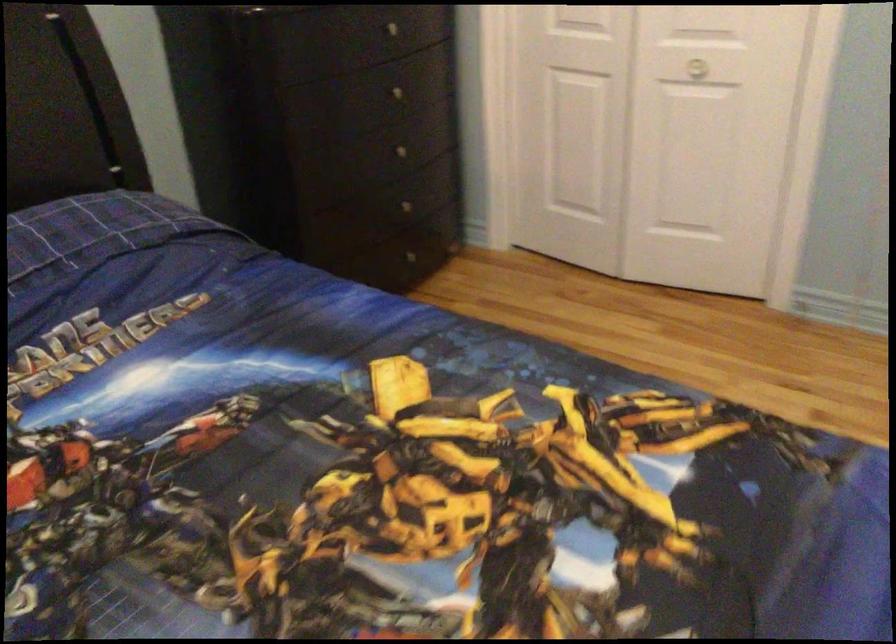
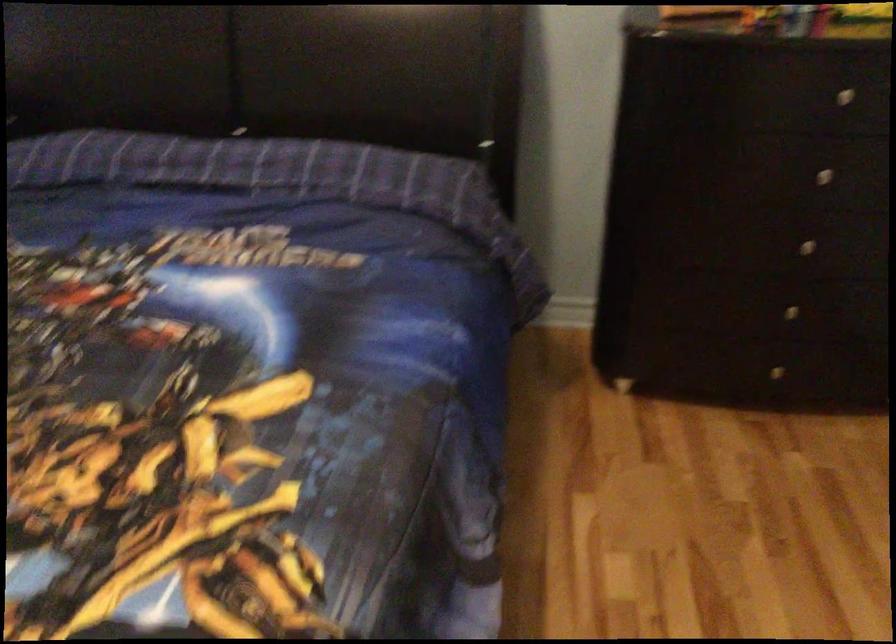
In the second image, find the point that corresponds to (411,204) in the first image.

(790, 310)